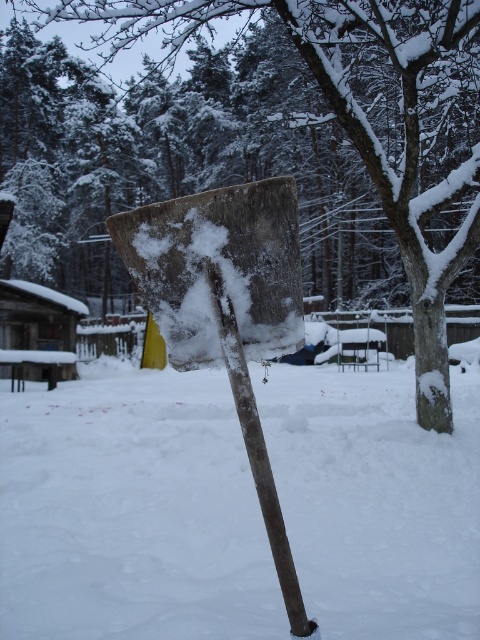
Question: Which point is farther to the camera?

Choices:
 (A) snow-covered wood at center
 (B) white fluffy snow at center

Answer: (A)

Question: Is white fluffy snow at center to the left of snow-covered wood at center from the viewer's perspective?

Choices:
 (A) no
 (B) yes

Answer: (A)

Question: Which object is farther from the camera taking this photo?

Choices:
 (A) white fluffy snow at center
 (B) snow-covered wood at center

Answer: (B)

Question: Among these objects, which one is nearest to the camera?

Choices:
 (A) white fluffy snow at center
 (B) snow-covered wood shovel at center

Answer: (B)

Question: Is white fluffy snow at center wider than snow-covered wood shovel at center?

Choices:
 (A) no
 (B) yes

Answer: (B)

Question: Does white fluffy snow at center appear under snow-covered wood at center?

Choices:
 (A) yes
 (B) no

Answer: (A)